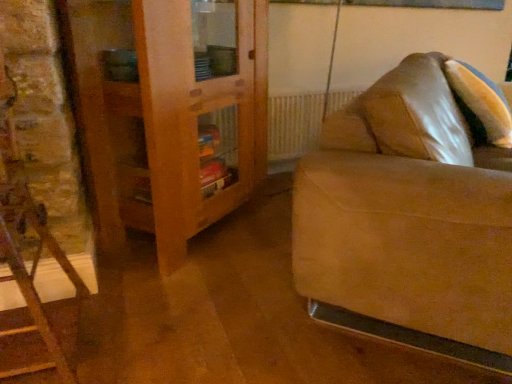
You are a GUI agent. You are given a task and a screenshot of the screen. Output one action in this format:
    pyautogui.click(x=<x>, y=<y>)
    Task: Click on the wooden cabinet at left
    The height and width of the screenshot is (384, 512).
    Given the screenshot: What is the action you would take?
    pyautogui.click(x=168, y=113)

What do you see at coordinates (168, 113) in the screenshot? This screenshot has height=384, width=512. I see `wooden cabinet at left` at bounding box center [168, 113].

The image size is (512, 384). Describe the element at coordinates (410, 218) in the screenshot. I see `suede couch at right` at that location.

At what (x,y) coordinates should I click in order to perform the action: click on suede couch at right. Please return your answer as a coordinate pair (x, y). The width and height of the screenshot is (512, 384). Looking at the image, I should click on (410, 218).

Find the location of a particular element. The height and width of the screenshot is (384, 512). wooden cabinet at left is located at coordinates (168, 113).

Is suede couch at right to the left or to the right of wooden cabinet at left in the image?

In the image, suede couch at right appears on the right side of wooden cabinet at left.

From the picture: Which object is further away from the camera taking this photo, suede couch at right or wooden cabinet at left?

wooden cabinet at left is further from the camera.

Considering the positions of point (484, 231) and point (173, 195), is point (484, 231) closer or farther from the camera than point (173, 195)?

Point (484, 231) is closer to the camera than point (173, 195).

From the image's perspective, is suede couch at right beneath wooden cabinet at left?

Yes.

From a real-world perspective, between suede couch at right and wooden cabinet at left, who is vertically lower?

suede couch at right.

Which object is wider, suede couch at right or wooden cabinet at left?

With larger width is suede couch at right.

Does suede couch at right have a greater height compared to wooden cabinet at left?

No, suede couch at right is not taller than wooden cabinet at left.

In terms of size, does suede couch at right appear bigger or smaller than wooden cabinet at left?

In the image, suede couch at right appears to be larger than wooden cabinet at left.

Based on the photo, is wooden cabinet at left completely or partially inside suede couch at right?

No, wooden cabinet at left is not surrounded by suede couch at right.

Is suede couch at right placed right next to wooden cabinet at left?

suede couch at right and wooden cabinet at left are clearly separated.

Could you tell me if suede couch at right is turned towards wooden cabinet at left?

No, suede couch at right is not facing towards wooden cabinet at left.

What's the angular difference between suede couch at right and wooden cabinet at left's facing directions?

The angle between the facing direction of suede couch at right and the facing direction of wooden cabinet at left is 5.55 degrees.

This screenshot has width=512, height=384. What are the coordinates of `dresser behind the suede couch at right` in the screenshot? It's located at (168, 113).

Would you say wooden cabinet at left is to the left or to the right of suede couch at right in the picture?

wooden cabinet at left is to the left of suede couch at right.

Which object is more forward, wooden cabinet at left or suede couch at right?

suede couch at right.

Is point (166, 131) positioned in front of point (404, 82)?

No, it is behind (404, 82).

From the image's perspective, which is below, wooden cabinet at left or suede couch at right?

suede couch at right is shown below in the image.

From a real-world perspective, which is physically below, wooden cabinet at left or suede couch at right?

In real-world perspective, suede couch at right is lower.

Is wooden cabinet at left wider or thinner than suede couch at right?

Considering their sizes, wooden cabinet at left looks slimmer than suede couch at right.

Who is taller, wooden cabinet at left or suede couch at right?

wooden cabinet at left is taller.

In the scene shown: Based on their sizes in the image, would you say wooden cabinet at left is bigger or smaller than suede couch at right?

In the image, wooden cabinet at left appears to be smaller than suede couch at right.

Is wooden cabinet at left positioned beyond the bounds of suede couch at right?

wooden cabinet at left lies outside suede couch at right's area.

Is wooden cabinet at left placed right next to suede couch at right?

No, wooden cabinet at left is not next to suede couch at right.

In the scene shown: Is wooden cabinet at left facing towards suede couch at right?

Yes, wooden cabinet at left is facing suede couch at right.

How distant is wooden cabinet at left from suede couch at right?

They are 31.37 inches apart.

Where is `dresser above the suede couch at right (from the image's perspective)`? This screenshot has height=384, width=512. dresser above the suede couch at right (from the image's perspective) is located at coordinates (168, 113).

You are a GUI agent. You are given a task and a screenshot of the screen. Output one action in this format:
    pyautogui.click(x=<x>, y=<y>)
    Task: Click on the studio couch in front of the wooden cabinet at left
    The image size is (512, 384).
    Given the screenshot: What is the action you would take?
    [410, 218]

In order to click on dresser above the suede couch at right (from a real-world perspective) in this screenshot , I will do `click(168, 113)`.